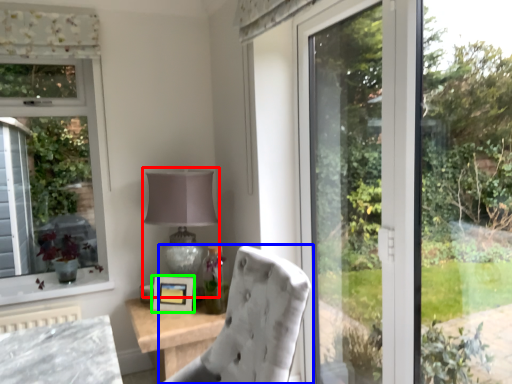
Question: Based on their relative distances, which object is farther from table lamp (highlighted by a red box)? Choose from chair (highlighted by a blue box) and picture frame (highlighted by a green box).

Choices:
 (A) chair
 (B) picture frame

Answer: (A)